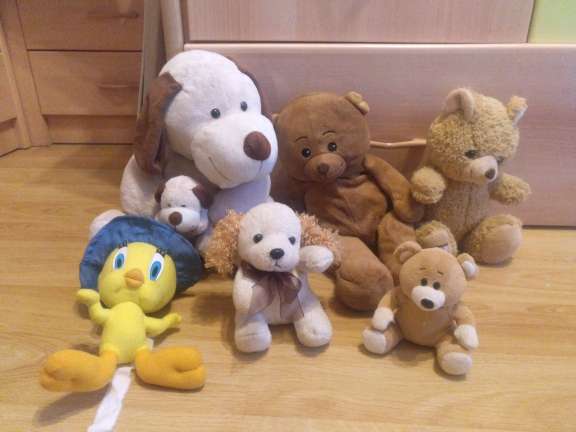
In order to click on stuffed animals that aren't bears in this screenshot , I will do `click(276, 263)`, `click(187, 207)`, `click(238, 152)`, `click(157, 270)`.